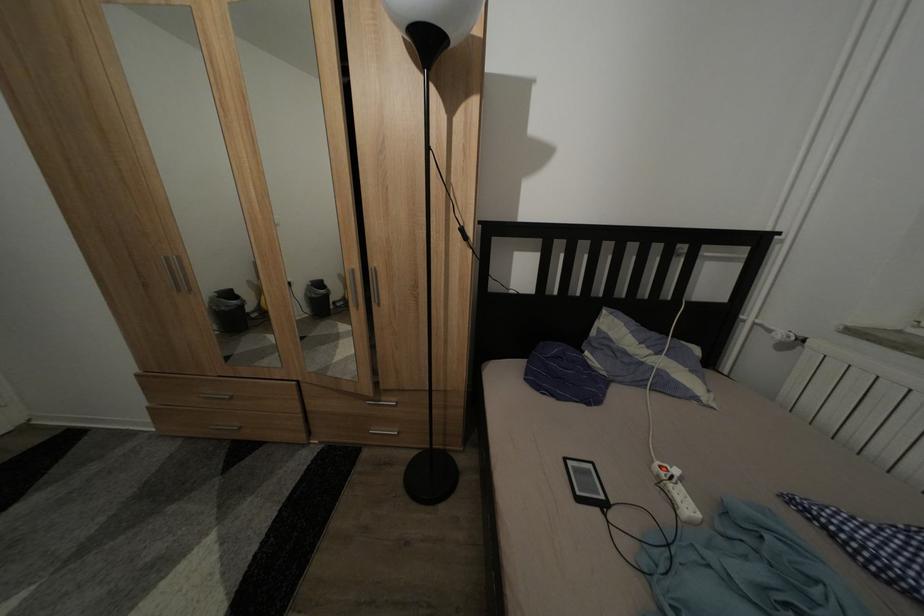
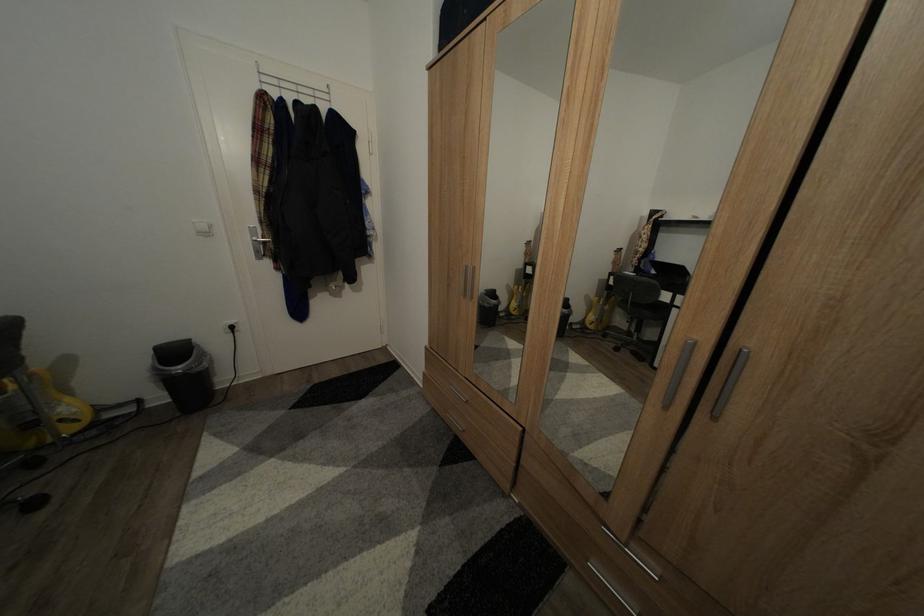
Question: The camera is either moving clockwise (left) or counter-clockwise (right) around the object. The first image is from the beginning of the video and the second image is from the end. Is the camera moving left or right when shooting the video?

Choices:
 (A) Left
 (B) Right

Answer: (B)